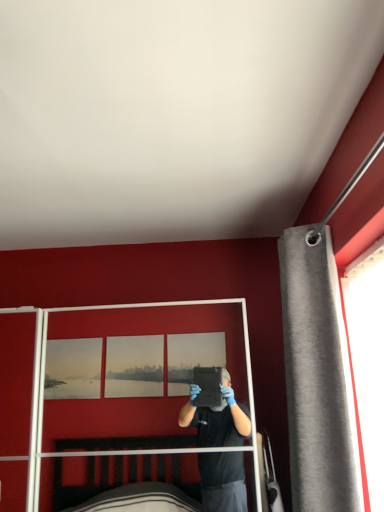
What do you see at coordinates (317, 377) in the screenshot? I see `gray fabric curtain at right` at bounding box center [317, 377].

You are a GUI agent. You are given a task and a screenshot of the screen. Output one action in this format:
    pyautogui.click(x=<x>, y=<y>)
    Task: Click on the gray fabric curtain at right
    This screenshot has height=512, width=384.
    Given the screenshot: What is the action you would take?
    pyautogui.click(x=317, y=377)

Measure the distance between clear plastic screen door at center and camera.

The distance of clear plastic screen door at center from camera is 1.49 meters.

This screenshot has height=512, width=384. I want to click on clear plastic screen door at center, so click(x=138, y=326).

The height and width of the screenshot is (512, 384). What do you see at coordinates (138, 326) in the screenshot?
I see `clear plastic screen door at center` at bounding box center [138, 326].

In order to click on gray fabric curtain at right in this screenshot , I will do `click(317, 377)`.

Visually, is gray fabric curtain at right positioned to the left or to the right of clear plastic screen door at center?

Based on their positions, gray fabric curtain at right is located to the right of clear plastic screen door at center.

Considering their positions, is gray fabric curtain at right located in front of or behind clear plastic screen door at center?

Visually, gray fabric curtain at right is located in front of clear plastic screen door at center.

Is point (316, 311) positioned after point (176, 413)?

No, (316, 311) is in front of (176, 413).

From the image's perspective, is gray fabric curtain at right above or below clear plastic screen door at center?

Based on their image positions, gray fabric curtain at right is located above clear plastic screen door at center.

From a real-world perspective, is gray fabric curtain at right positioned over clear plastic screen door at center based on gravity?

Indeed, from a real-world perspective, gray fabric curtain at right stands above clear plastic screen door at center.

Consider the image. Considering the relative sizes of gray fabric curtain at right and clear plastic screen door at center in the image provided, is gray fabric curtain at right wider than clear plastic screen door at center?

Incorrect, the width of gray fabric curtain at right does not surpass that of clear plastic screen door at center.

Considering the sizes of objects gray fabric curtain at right and clear plastic screen door at center in the image provided, who is taller, gray fabric curtain at right or clear plastic screen door at center?

Standing taller between the two is gray fabric curtain at right.

In the scene shown: Can you confirm if gray fabric curtain at right is bigger than clear plastic screen door at center?

No, gray fabric curtain at right is not bigger than clear plastic screen door at center.

Would you say gray fabric curtain at right is outside clear plastic screen door at center?

Absolutely, gray fabric curtain at right is external to clear plastic screen door at center.

Are gray fabric curtain at right and clear plastic screen door at center beside each other?

No, gray fabric curtain at right is not in contact with clear plastic screen door at center.

Is gray fabric curtain at right oriented towards clear plastic screen door at center?

Yes.

How many degrees apart are the facing directions of gray fabric curtain at right and clear plastic screen door at center?

The facing directions of gray fabric curtain at right and clear plastic screen door at center are 88.7 degrees apart.

Locate an element on the screen. screen door that appears behind the gray fabric curtain at right is located at coordinates (138, 326).

Which object is positioned more to the left, clear plastic screen door at center or gray fabric curtain at right?

clear plastic screen door at center is more to the left.

Looking at this image, considering the relative positions of clear plastic screen door at center and gray fabric curtain at right in the image provided, is clear plastic screen door at center behind gray fabric curtain at right?

Yes, it is.

Is point (255, 460) closer or farther from the camera than point (320, 353)?

Point (255, 460) appears to be farther away from the viewer than point (320, 353).

From the image's perspective, who appears lower, clear plastic screen door at center or gray fabric curtain at right?

clear plastic screen door at center appears lower in the image.

From a real-world perspective, who is located lower, clear plastic screen door at center or gray fabric curtain at right?

clear plastic screen door at center.

Does clear plastic screen door at center have a lesser width compared to gray fabric curtain at right?

No, clear plastic screen door at center is not thinner than gray fabric curtain at right.

Is clear plastic screen door at center taller or shorter than gray fabric curtain at right?

Clearly, clear plastic screen door at center is shorter compared to gray fabric curtain at right.

Which of these two, clear plastic screen door at center or gray fabric curtain at right, is smaller?

Smaller between the two is gray fabric curtain at right.

Which is correct: clear plastic screen door at center is inside gray fabric curtain at right, or outside of it?

clear plastic screen door at center lies outside gray fabric curtain at right.

Is clear plastic screen door at center next to gray fabric curtain at right and touching it?

No, clear plastic screen door at center is not touching gray fabric curtain at right.

Is clear plastic screen door at center oriented towards gray fabric curtain at right?

No, clear plastic screen door at center is not facing towards gray fabric curtain at right.

How far apart are clear plastic screen door at center and gray fabric curtain at right?

A distance of 13.20 inches exists between clear plastic screen door at center and gray fabric curtain at right.

Where is `curtain above the clear plastic screen door at center (from the image's perspective)`? Image resolution: width=384 pixels, height=512 pixels. curtain above the clear plastic screen door at center (from the image's perspective) is located at coordinates (317, 377).

You are a GUI agent. You are given a task and a screenshot of the screen. Output one action in this format:
    pyautogui.click(x=<x>, y=<y>)
    Task: Click on the curtain located above the clear plastic screen door at center (from a real-world perspective)
    The width and height of the screenshot is (384, 512).
    Given the screenshot: What is the action you would take?
    pyautogui.click(x=317, y=377)

This screenshot has height=512, width=384. In the image, there is a clear plastic screen door at center. Find the location of `curtain above it (from the image's perspective)`. curtain above it (from the image's perspective) is located at coordinates (317, 377).